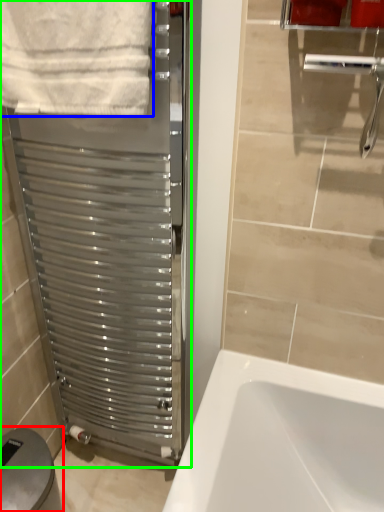
Question: Which object is positioned farthest from gray (highlighted by a red box)? Select from towel (highlighted by a blue box) and screen door (highlighted by a green box).

Choices:
 (A) towel
 (B) screen door

Answer: (A)